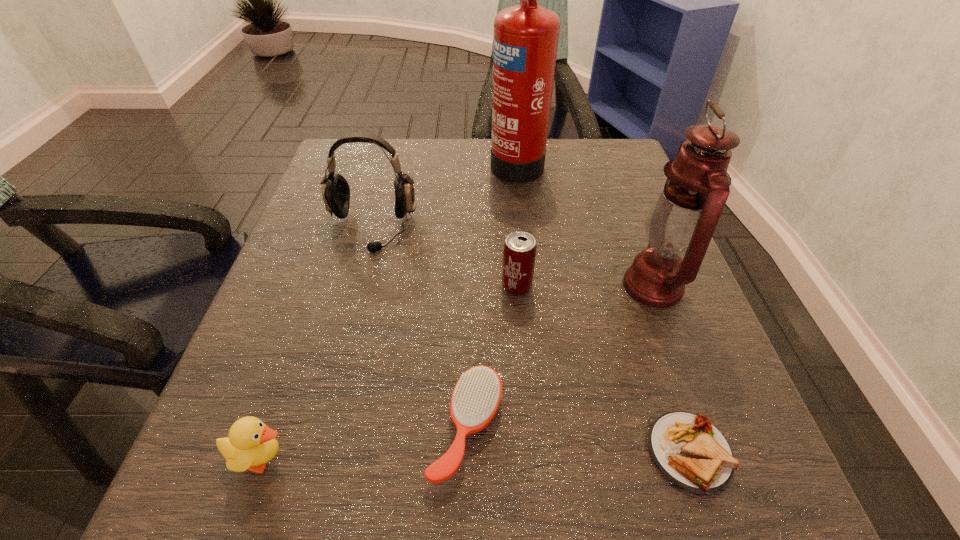
Locate an element on the screen. The image size is (960, 540). vacant position at the left edge of the desktop is located at coordinates (308, 293).

Find the location of a particular element. This screenshot has height=540, width=960. free spot at the right edge of the desktop is located at coordinates (716, 413).

The image size is (960, 540). Find the location of `free space at the far left corner of the desktop`. free space at the far left corner of the desktop is located at coordinates (377, 160).

This screenshot has height=540, width=960. Find the location of `free point at the near left corner`. free point at the near left corner is located at coordinates (231, 529).

Locate an element on the screen. This screenshot has width=960, height=540. free space at the far right corner of the desktop is located at coordinates (611, 163).

Find the location of a particular element. The height and width of the screenshot is (540, 960). free spot between the headset and the beer can is located at coordinates (444, 258).

You are a GUI agent. You are given a task and a screenshot of the screen. Output one action in this format:
    pyautogui.click(x=<x>, y=<y>)
    Task: Click on the vacant space that is in between the tallest object and the sixth tallest object
    This screenshot has height=540, width=960.
    Given the screenshot: What is the action you would take?
    pyautogui.click(x=492, y=294)

I want to click on unoccupied area between the shortest object and the fifth tallest object, so click(476, 455).

Where is `empty space between the beer can and the third shortest object`? empty space between the beer can and the third shortest object is located at coordinates (390, 372).

Locate an element on the screen. The image size is (960, 540). vacant area that lies between the beer can and the tallest object is located at coordinates (516, 224).